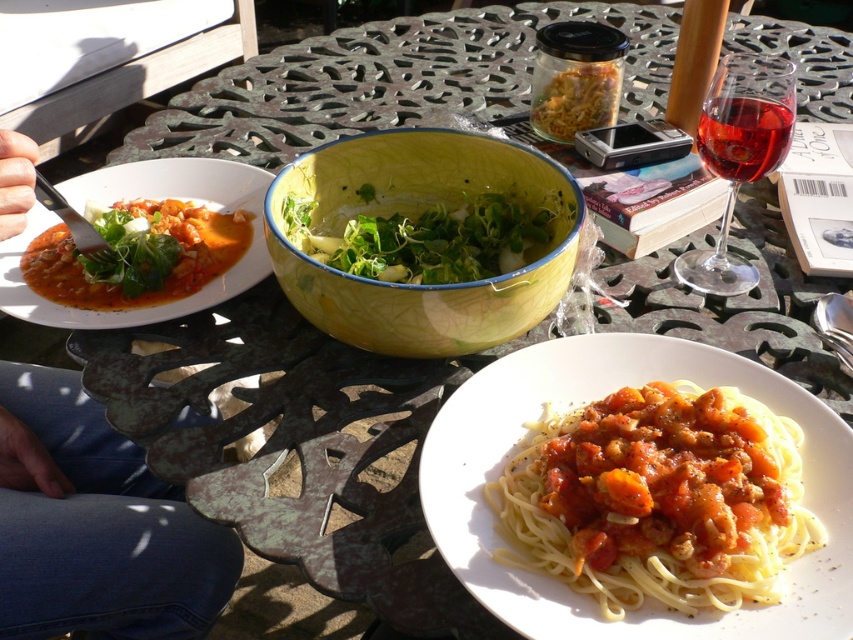
Question: Based on their relative distances, which object is farther from the green leafy salad at center?

Choices:
 (A) tomato-based sauce at upper left
 (B) yellow glazed bowl at center
 (C) blue jeans at lower left
 (D) white matte spaghetti at lower right

Answer: (C)

Question: Is yellow glazed bowl at center positioned before translucent glass wine glass at upper right?

Choices:
 (A) no
 (B) yes

Answer: (B)

Question: Which point is farther to the camera?

Choices:
 (A) tomato-based sauce at upper left
 (B) green leafy salad at center
 (C) blue jeans at lower left

Answer: (A)

Question: Is white matte spaghetti at lower right positioned before tomato-based sauce at upper left?

Choices:
 (A) no
 (B) yes

Answer: (B)

Question: Which point is farther to the camera?

Choices:
 (A) blue jeans at lower left
 (B) yellow glazed bowl at center
 (C) red glass at upper right

Answer: (C)

Question: Can you confirm if white matte spaghetti at lower right is thinner than translucent glass wine glass at upper right?

Choices:
 (A) yes
 (B) no

Answer: (B)